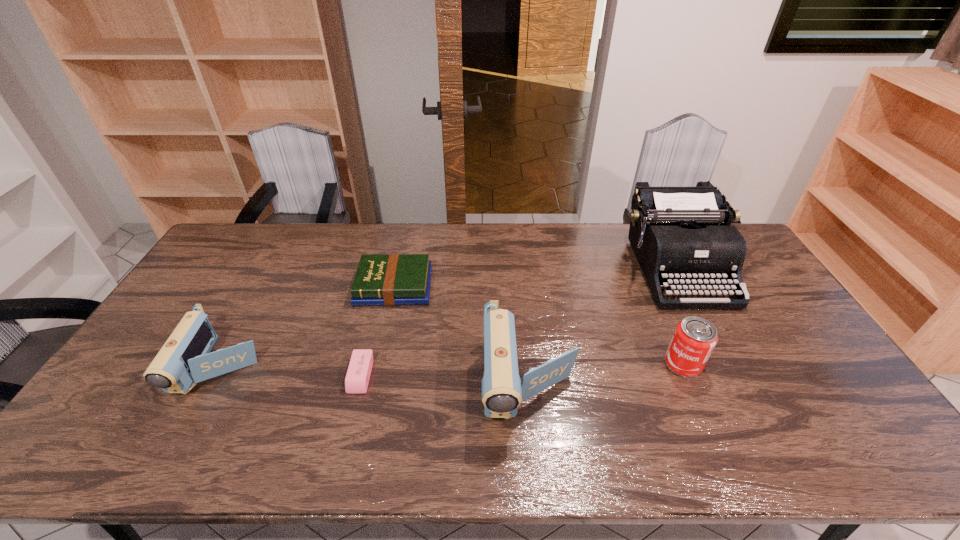
What are the coordinates of `vacant space at the left edge` in the screenshot? It's located at (121, 386).

Locate an element on the screen. blank region between the typewriter and the can is located at coordinates (679, 316).

At what (x,y) coordinates should I click in order to perform the action: click on free space that is in between the leftmost object and the eraser. Please return your answer as a coordinate pair (x, y). This screenshot has height=540, width=960. Looking at the image, I should click on (292, 372).

The width and height of the screenshot is (960, 540). Identify the location of empty location between the left camcorder and the book. click(x=308, y=328).

The image size is (960, 540). Identify the location of empty space that is in between the right camcorder and the can. (606, 374).

I want to click on free space between the fifth shortest object and the second shortest object, so [462, 335].

The width and height of the screenshot is (960, 540). I want to click on free area in between the tallest object and the second shortest object, so click(x=535, y=278).

At what (x,y) coordinates should I click in order to perform the action: click on unoccupied area between the leftmost object and the eraser. Please return your answer as a coordinate pair (x, y). Looking at the image, I should click on (292, 372).

In order to click on vacant region between the taller camcorder and the eraser in this screenshot , I will do `click(444, 380)`.

In order to click on free space between the shorter camcorder and the fifth shortest object in this screenshot , I will do `click(375, 376)`.